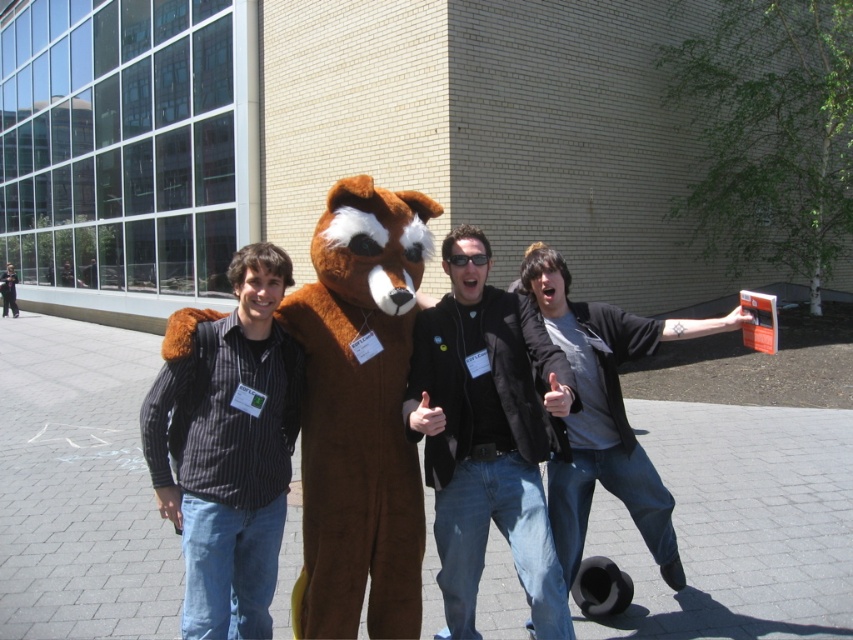
Question: Among these objects, which one is farthest from the camera?

Choices:
 (A) striped shirt at left
 (B) gray cotton shirt at center
 (C) black plastic goggles at center
 (D) brown furry mascot at center

Answer: (C)

Question: Based on their relative distances, which object is nearer to the black plastic goggles at center?

Choices:
 (A) gray cotton shirt at center
 (B) brown furry mascot at center
 (C) striped shirt at left

Answer: (B)

Question: Can you confirm if brown furry mascot at center is bigger than striped shirt at left?

Choices:
 (A) yes
 (B) no

Answer: (A)

Question: Is brown furry mascot at center closer to the viewer compared to gray cotton shirt at center?

Choices:
 (A) yes
 (B) no

Answer: (A)

Question: Does brown furry mascot at center appear under black plastic goggles at center?

Choices:
 (A) yes
 (B) no

Answer: (A)

Question: Among these points, which one is farthest from the camera?

Choices:
 (A) (525, 259)
 (B) (360, 516)

Answer: (A)